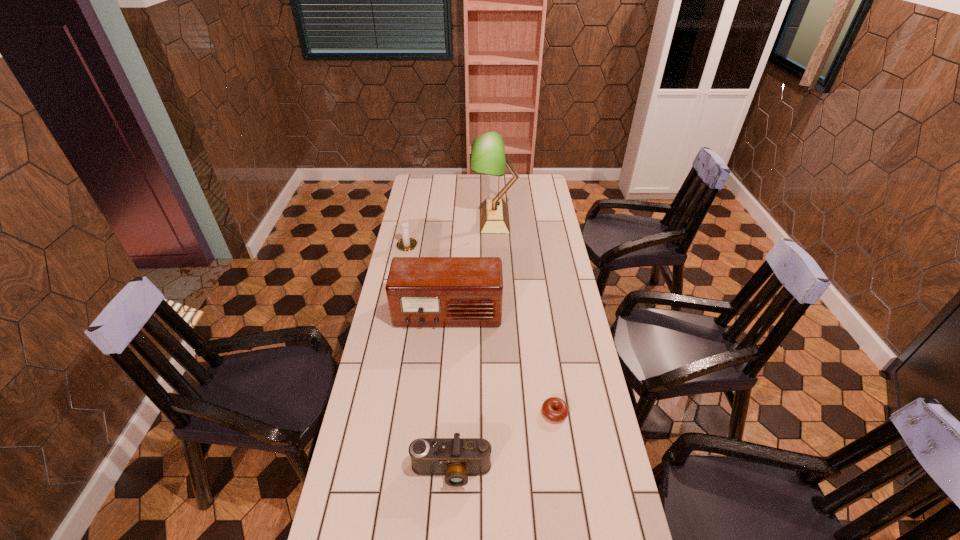
Where is `candle holder at the left edge`? The width and height of the screenshot is (960, 540). candle holder at the left edge is located at coordinates (405, 244).

Locate an element on the screen. This screenshot has height=540, width=960. object at the right edge is located at coordinates (548, 406).

Locate an element on the screen. free spot at the left edge of the desktop is located at coordinates (383, 308).

Find the location of a particular element. This screenshot has height=540, width=960. vacant space at the right edge of the desktop is located at coordinates (549, 228).

In the image, there is a desktop. Where is `vacant space at the far right corner`? This screenshot has height=540, width=960. vacant space at the far right corner is located at coordinates (530, 182).

The width and height of the screenshot is (960, 540). Find the location of `blank region between the second nearest object and the farthest object`. blank region between the second nearest object and the farthest object is located at coordinates (524, 316).

Where is `vacant point located between the camera and the farthest object`? This screenshot has width=960, height=540. vacant point located between the camera and the farthest object is located at coordinates (473, 345).

This screenshot has width=960, height=540. What are the coordinates of `vacant space in between the shortest object and the camera` in the screenshot? It's located at (503, 442).

This screenshot has height=540, width=960. I want to click on vacant point located between the table lamp and the doughnut, so click(524, 316).

At what (x,y) coordinates should I click in order to perform the action: click on vacant area between the nearest object and the rightmost object. Please return your answer as a coordinate pair (x, y). This screenshot has width=960, height=540. Looking at the image, I should click on (503, 442).